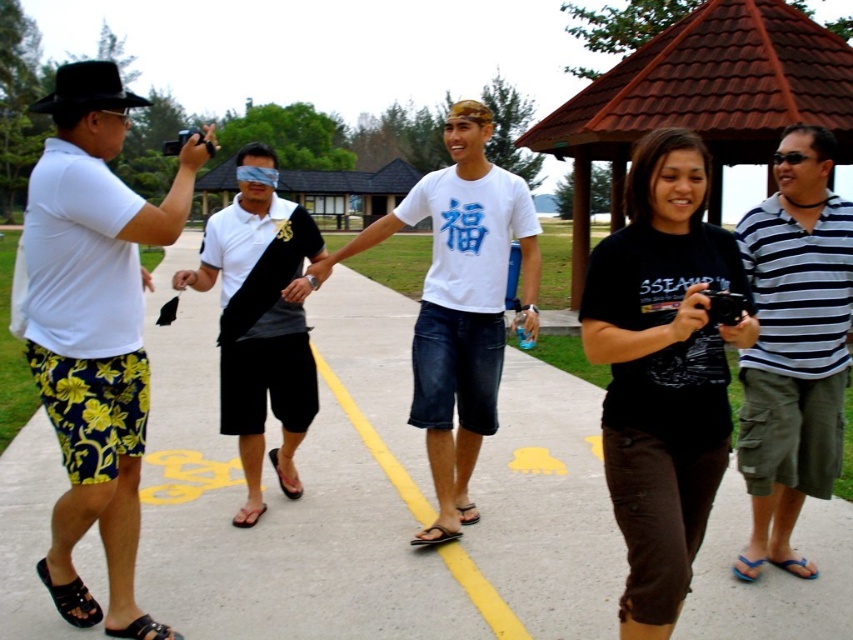
How much distance is there between white matte t-shirt at center and black matte shorts at center?

white matte t-shirt at center is 1.80 meters away from black matte shorts at center.

Is white matte t-shirt at center thinner than black matte shorts at center?

Incorrect, white matte t-shirt at center's width is not less than black matte shorts at center's.

Identify the location of white matte t-shirt at center. [460, 304].

At what (x,y) coordinates should I click in order to perform the action: click on white matte t-shirt at center. Please return your answer as a coordinate pair (x, y). The height and width of the screenshot is (640, 853). Looking at the image, I should click on (460, 304).

Is point (401, 608) closer to camera compared to point (288, 365)?

Yes, it is.

Who is positioned more to the left, concrete at center or black matte shorts at center?

concrete at center is more to the left.

Where is `concrete at center`? concrete at center is located at coordinates (370, 493).

At what (x,y) coordinates should I click in order to perform the action: click on concrete at center. Please return your answer as a coordinate pair (x, y). Looking at the image, I should click on (370, 493).

Does floral print shorts at left have a smaller size compared to striped cotton shirt at right?

No, floral print shorts at left is not smaller than striped cotton shirt at right.

This screenshot has height=640, width=853. What do you see at coordinates (96, 328) in the screenshot? I see `floral print shorts at left` at bounding box center [96, 328].

At what (x,y) coordinates should I click in order to perform the action: click on floral print shorts at left. Please return your answer as a coordinate pair (x, y). This screenshot has width=853, height=640. Looking at the image, I should click on (96, 328).